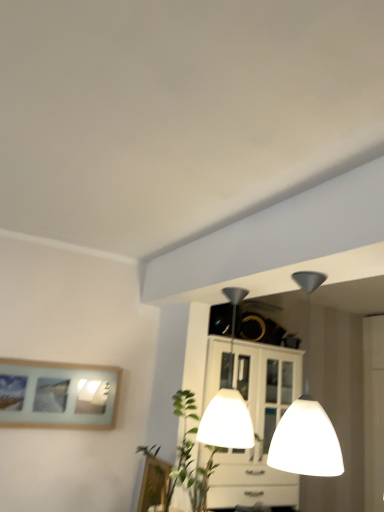
Question: Can you confirm if white glossy lampshade at upper center, acting as the first lamp starting from the front, is positioned to the right of white glossy lampshade at center, acting as the first lamp starting from the back?

Choices:
 (A) no
 (B) yes

Answer: (B)

Question: From a real-world perspective, is white glossy lampshade at upper center, marked as the second lamp in a back-to-front arrangement, physically below white glossy lampshade at center, acting as the first lamp starting from the back?

Choices:
 (A) no
 (B) yes

Answer: (B)

Question: Can you confirm if white glossy lampshade at upper center, acting as the first lamp starting from the front, is bigger than white glossy lampshade at center, which is the 2th lamp in front-to-back order?

Choices:
 (A) no
 (B) yes

Answer: (A)

Question: Is white glossy lampshade at upper center, acting as the first lamp starting from the front, placed right next to white glossy lampshade at center, acting as the first lamp starting from the back?

Choices:
 (A) yes
 (B) no

Answer: (B)

Question: Is white glossy lampshade at upper center, marked as the second lamp in a back-to-front arrangement, not within white glossy lampshade at center, which is the 2th lamp in front-to-back order?

Choices:
 (A) no
 (B) yes

Answer: (B)

Question: Would you say white glossy lampshade at center, acting as the first lamp starting from the back, is inside or outside wooden picture frame at lower center, the 2th picture frame from the top?

Choices:
 (A) outside
 (B) inside

Answer: (A)

Question: Does point (230, 436) appear closer or farther from the camera than point (155, 468)?

Choices:
 (A) farther
 (B) closer

Answer: (B)

Question: Is white glossy lampshade at center, acting as the first lamp starting from the back, taller or shorter than wooden picture frame at lower center, the 2th picture frame from the top?

Choices:
 (A) short
 (B) tall

Answer: (B)

Question: Is white glossy lampshade at center, acting as the first lamp starting from the back, in front of or behind wooden picture frame at lower center, the first picture frame in the bottom-to-top sequence, in the image?

Choices:
 (A) behind
 (B) front

Answer: (B)

Question: Based on their sizes in the image, would you say white glossy lampshade at center, which is the 2th lamp in front-to-back order, is bigger or smaller than wooden framed picture at left, the 2th picture frame ordered from the bottom?

Choices:
 (A) big
 (B) small

Answer: (A)

Question: From the image's perspective, is white glossy lampshade at center, acting as the first lamp starting from the back, above or below wooden framed picture at left, marked as the 2th picture frame in a right-to-left arrangement?

Choices:
 (A) below
 (B) above

Answer: (B)

Question: Relative to wooden framed picture at left, the 2th picture frame ordered from the bottom, is white glossy lampshade at center, which is the 2th lamp in front-to-back order, in front or behind?

Choices:
 (A) front
 (B) behind

Answer: (A)

Question: From a real-world perspective, is white glossy lampshade at center, which is the 2th lamp in front-to-back order, above or below wooden framed picture at left, positioned as the 1th picture frame in top-to-bottom order?

Choices:
 (A) above
 (B) below

Answer: (A)

Question: In terms of size, does white glossy lampshade at upper center, acting as the first lamp starting from the front, appear bigger or smaller than wooden picture frame at lower center, the 2th picture frame from the top?

Choices:
 (A) small
 (B) big

Answer: (B)

Question: From a real-world perspective, is white glossy lampshade at upper center, marked as the second lamp in a back-to-front arrangement, physically located above or below wooden picture frame at lower center, the 2th picture frame in the left-to-right sequence?

Choices:
 (A) above
 (B) below

Answer: (A)